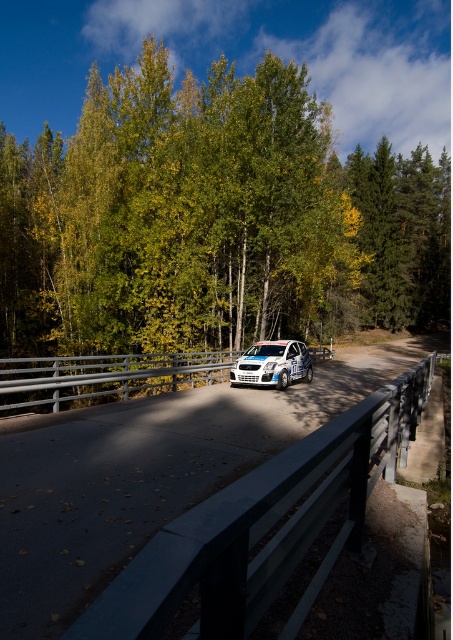
You are a photographer positioned at the side of the road. You want to capture a photo of the white glossy rally car at center while ensuring the green leafy tree at center is visible in the background. Is the tree taller than the car?

The green leafy tree at center is taller than the white glossy rally car at center, so yes, the tree will appear taller in the photo.

You are a spectator standing at the side of the road watching the rally car race. Which object is closer to your left side, the green leafy tree at center or the white glossy rally car at center?

The green leafy tree at center is positioned on the right side of the white glossy rally car at center, so the white glossy rally car at center is closer to your left side.